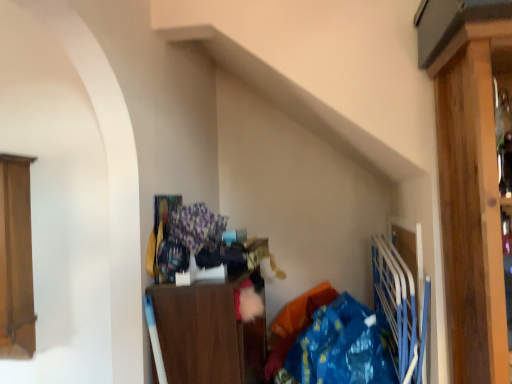
Question: Is wooden cabinet at center, which ranks as the first cabinetry in right-to-left order, wider than blue plastic bag at lower right?

Choices:
 (A) no
 (B) yes

Answer: (A)

Question: Considering the relative sizes of wooden cabinet at center, arranged as the 2th cabinetry when viewed from the left, and blue plastic bag at lower right in the image provided, is wooden cabinet at center, arranged as the 2th cabinetry when viewed from the left, taller than blue plastic bag at lower right?

Choices:
 (A) no
 (B) yes

Answer: (B)

Question: Is wooden cabinet at center, which ranks as the first cabinetry in right-to-left order, oriented away from blue plastic bag at lower right?

Choices:
 (A) no
 (B) yes

Answer: (B)

Question: Is wooden cabinet at center, arranged as the 2th cabinetry when viewed from the left, aimed at blue plastic bag at lower right?

Choices:
 (A) yes
 (B) no

Answer: (A)

Question: Can you confirm if wooden cabinet at center, which ranks as the first cabinetry in right-to-left order, is bigger than blue plastic bag at lower right?

Choices:
 (A) no
 (B) yes

Answer: (B)

Question: From a real-world perspective, is wooden cabinet at center, which ranks as the first cabinetry in right-to-left order, on top of blue plastic bag at lower right?

Choices:
 (A) yes
 (B) no

Answer: (A)

Question: Is wooden cabinet at center, which ranks as the first cabinetry in right-to-left order, oriented towards wooden cabinet at left, positioned as the second cabinetry in right-to-left order?

Choices:
 (A) yes
 (B) no

Answer: (B)

Question: Is wooden cabinet at center, arranged as the 2th cabinetry when viewed from the left, in contact with wooden cabinet at left, positioned as the second cabinetry in right-to-left order?

Choices:
 (A) no
 (B) yes

Answer: (A)

Question: Can you confirm if wooden cabinet at center, arranged as the 2th cabinetry when viewed from the left, is bigger than wooden cabinet at left, positioned as the second cabinetry in right-to-left order?

Choices:
 (A) yes
 (B) no

Answer: (A)

Question: Is wooden cabinet at left, positioned as the second cabinetry in right-to-left order, located within wooden cabinet at center, arranged as the 2th cabinetry when viewed from the left?

Choices:
 (A) yes
 (B) no

Answer: (B)

Question: From the image's perspective, is wooden cabinet at center, which ranks as the first cabinetry in right-to-left order, below wooden cabinet at left, positioned as the second cabinetry in right-to-left order?

Choices:
 (A) no
 (B) yes

Answer: (B)

Question: Can you confirm if wooden cabinet at center, arranged as the 2th cabinetry when viewed from the left, is positioned to the left of wooden cabinet at left, which ranks as the 1th cabinetry in left-to-right order?

Choices:
 (A) no
 (B) yes

Answer: (A)

Question: From the image's perspective, would you say wooden cabinet at left, positioned as the second cabinetry in right-to-left order, is positioned over blue plastic bag at lower right?

Choices:
 (A) yes
 (B) no

Answer: (A)